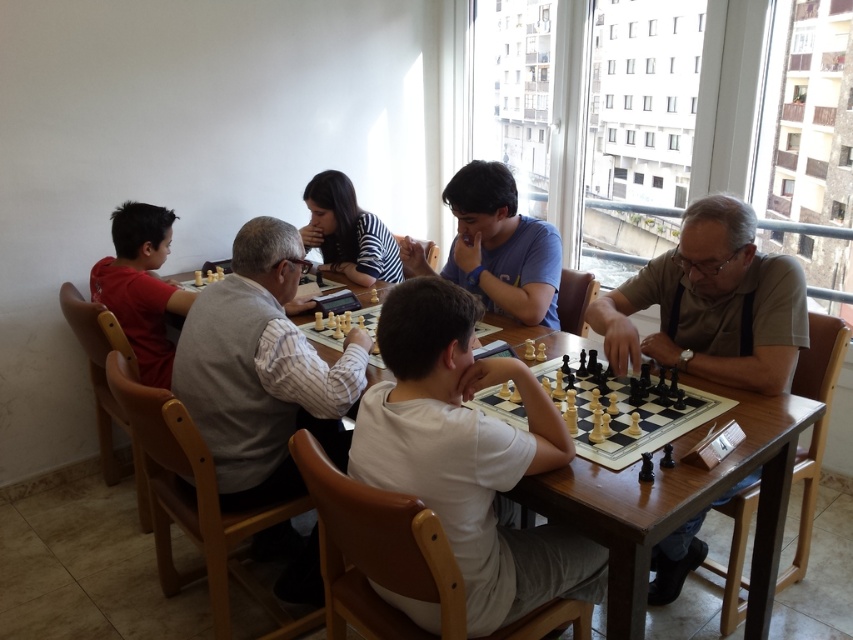
Can you confirm if white shirt at center is thinner than matte beige shirt at center?

No.

Is white shirt at center closer to the viewer compared to matte beige shirt at center?

No, white shirt at center is behind matte beige shirt at center.

Does point (335, 368) lie in front of point (798, 326)?

That is False.

At what (x,y) coordinates should I click in order to perform the action: click on white shirt at center. Please return your answer as a coordinate pair (x, y). Looking at the image, I should click on (262, 371).

Can you confirm if white shirt at center is positioned to the left of matte red shirt at left?

Incorrect, white shirt at center is not on the left side of matte red shirt at left.

Does white shirt at center have a smaller size compared to matte red shirt at left?

No.

Find the location of `white shirt at center`. white shirt at center is located at coordinates (262, 371).

At what (x,y) coordinates should I click in order to perform the action: click on white shirt at center. Please return your answer as a coordinate pair (x, y). Looking at the image, I should click on (262, 371).

How far apart are matte red shirt at left and striped fabric shirt at center?

matte red shirt at left and striped fabric shirt at center are 30.86 inches apart.

Who is higher up, matte red shirt at left or striped fabric shirt at center?

Positioned higher is striped fabric shirt at center.

Where is `matte red shirt at left`? The image size is (853, 640). matte red shirt at left is located at coordinates (141, 285).